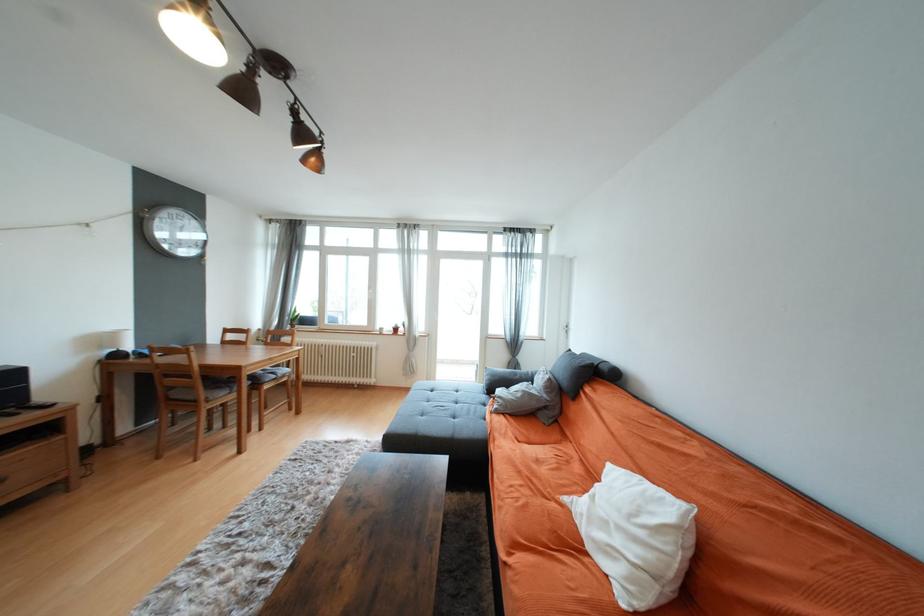
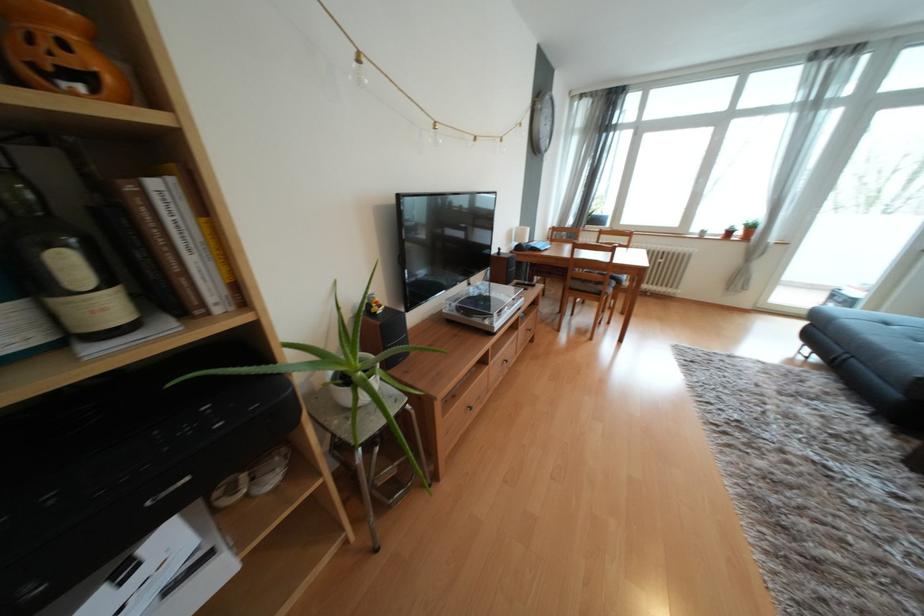
The point at (245, 536) is marked in the first image. Where is the corresponding point in the second image?

(745, 424)